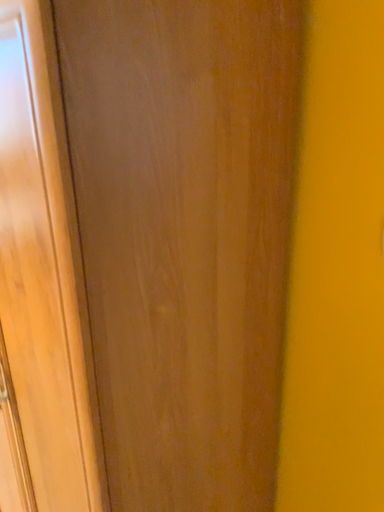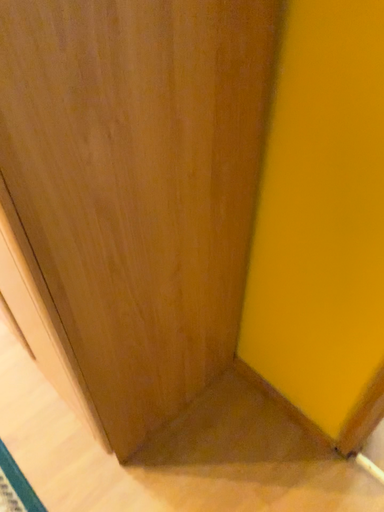
Question: Which way did the camera rotate in the video?

Choices:
 (A) rotated downward
 (B) rotated upward

Answer: (A)